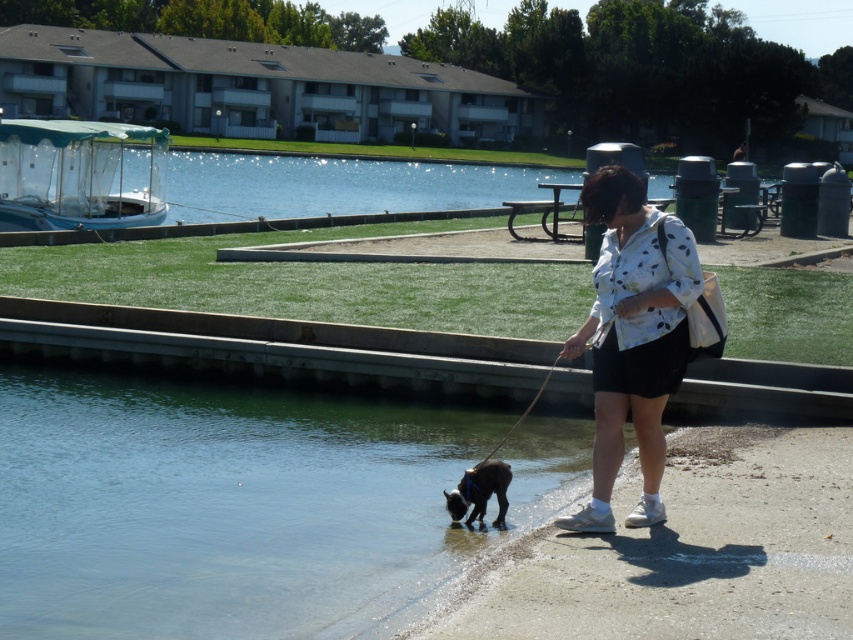
You are standing at the point marked by the coordinates point (631,339) in the image. Looking around, you see the woman walking her dog along the water edge. Can you describe what you see directly in front of you?

The point (631,339) indicates white dotted shirt at center, so directly in front of you would be the woman wearing the white dotted shirt at center.

You are a photographer standing at the edge of the water. You want to take a photo of the white dotted shirt at center and the black fur dog at lower left. If your camera can focus on objects within 1 meter, will both subjects be in focus?

The white dotted shirt at center is 83.43 centimeters away from the black fur dog at lower left. Since 83.43 centimeters is less than 1 meter, both subjects will be within the camera focus range and thus in focus.

You are standing at the camera position and want to throw a ball to a friend who is at point (x=485, y=509). There is an obstacle at point (x=653, y=220). Will the ball pass over the obstacle?

Point (x=653, y=220) is closer to the camera than point (x=485, y=509), so the ball will pass over the obstacle at point (x=653, y=220) on its way to your friend.